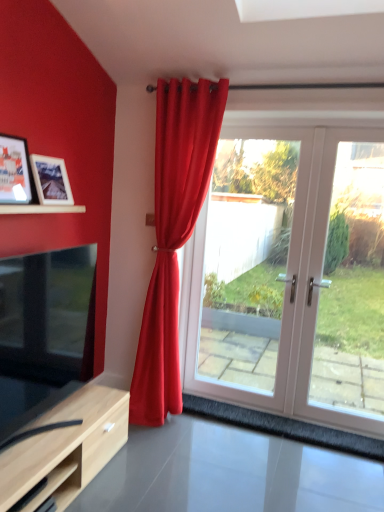
Locate an element on the screen. The width and height of the screenshot is (384, 512). vacant area that is in front of matte red curtain at center is located at coordinates (179, 454).